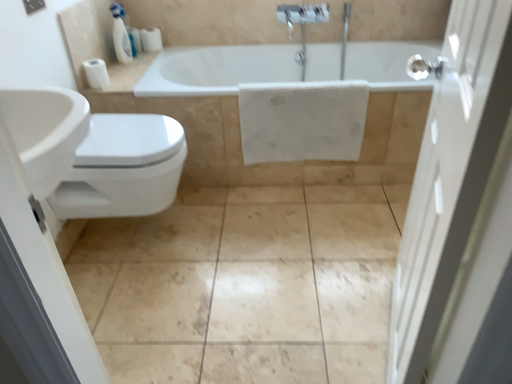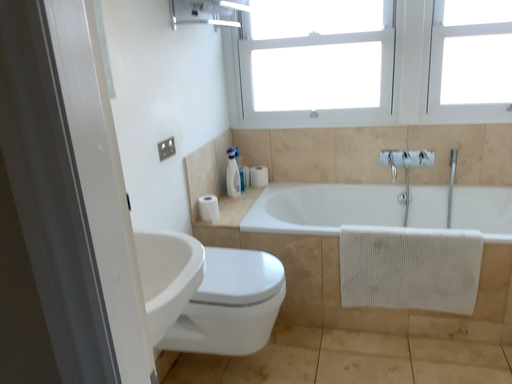
Question: How did the camera likely rotate when shooting the video?

Choices:
 (A) rotated downward
 (B) rotated upward

Answer: (B)